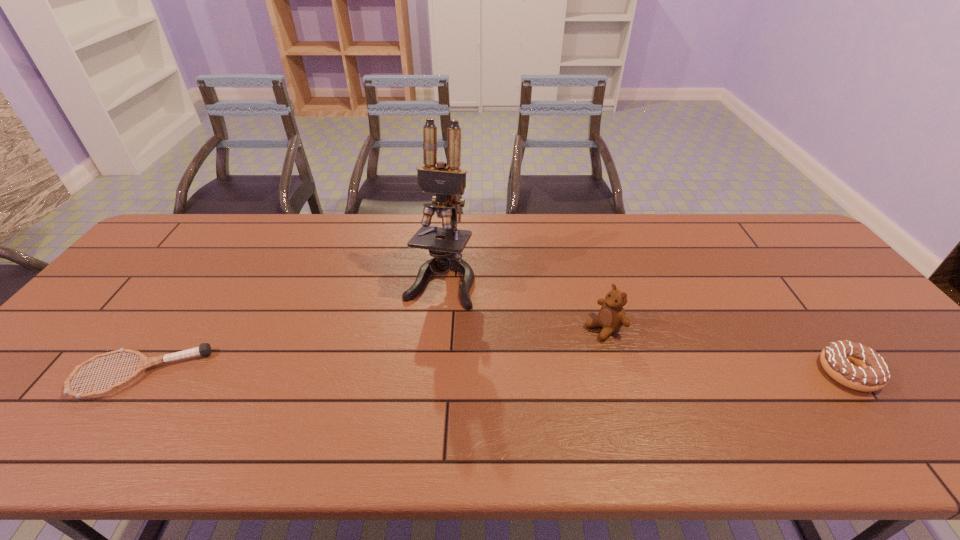
In order to click on empty location between the rightmost object and the microscope in this screenshot , I will do `click(644, 326)`.

You are a GUI agent. You are given a task and a screenshot of the screen. Output one action in this format:
    pyautogui.click(x=<x>, y=<y>)
    Task: Click on the free space between the microscope and the shortest object
    This screenshot has height=540, width=960.
    Given the screenshot: What is the action you would take?
    pyautogui.click(x=290, y=327)

Where is `unoccupied area between the shortest object and the rightmost object`? The image size is (960, 540). unoccupied area between the shortest object and the rightmost object is located at coordinates (494, 373).

Identify the location of free space between the doughnut and the second tallest object. (726, 349).

I want to click on free spot between the third object from left to right and the third tallest object, so click(726, 349).

You are a GUI agent. You are given a task and a screenshot of the screen. Output one action in this format:
    pyautogui.click(x=<x>, y=<y>)
    Task: Click on the free area in between the second object from left to right and the tennis racket
    
    Given the screenshot: What is the action you would take?
    pyautogui.click(x=290, y=327)

Identify which object is the third nearest to the leftmost object. Please provide its 2D coordinates. Your answer should be formatted as a tuple, i.e. [(x, y)], where the tuple contains the x and y coordinates of a point satisfying the conditions above.

[(854, 365)]

Select which object is the third closest to the doughnut. Please provide its 2D coordinates. Your answer should be formatted as a tuple, i.e. [(x, y)], where the tuple contains the x and y coordinates of a point satisfying the conditions above.

[(204, 349)]

You are a GUI agent. You are given a task and a screenshot of the screen. Output one action in this format:
    pyautogui.click(x=<x>, y=<y>)
    Task: Click on the vacant area in the image that satisfies the following two spatial constraints: 1. on the back side of the leftmost object; 2. on the right side of the third tallest object
    This screenshot has height=540, width=960.
    Given the screenshot: What is the action you would take?
    pyautogui.click(x=141, y=372)

Locate an element on the screen. The width and height of the screenshot is (960, 540). free space in the image that satisfies the following two spatial constraints: 1. on the back side of the tennis racket; 2. on the left side of the microscope is located at coordinates (207, 279).